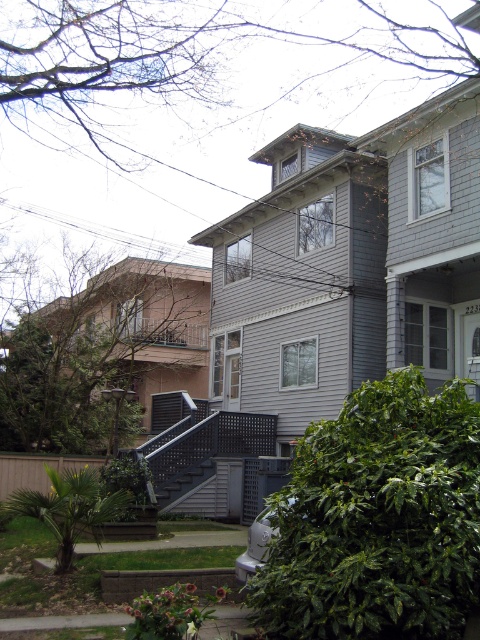
Question: Which point is closer to the camera?

Choices:
 (A) (262, 541)
 (B) (186, 474)

Answer: (A)

Question: Does silver metallic car at lower center appear under gray lattice stairs at center?

Choices:
 (A) yes
 (B) no

Answer: (B)

Question: Which of the following is the farthest from the observer?

Choices:
 (A) (195, 480)
 (B) (248, 540)

Answer: (A)

Question: Which point is farther to the camera?

Choices:
 (A) silver metallic car at lower center
 (B) gray lattice stairs at center

Answer: (B)

Question: Can you confirm if silver metallic car at lower center is bigger than gray lattice stairs at center?

Choices:
 (A) yes
 (B) no

Answer: (B)

Question: Is silver metallic car at lower center positioned at the back of gray lattice stairs at center?

Choices:
 (A) yes
 (B) no

Answer: (B)